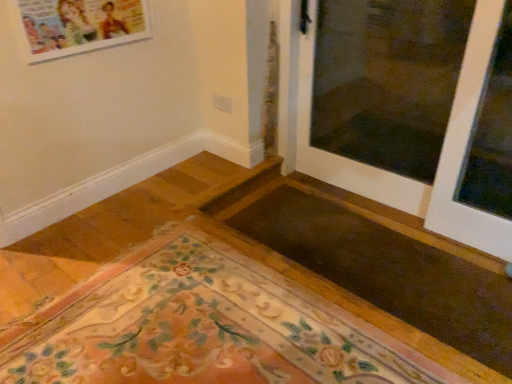
Where is `floral carpet at lower left`? This screenshot has height=384, width=512. floral carpet at lower left is located at coordinates (202, 327).

This screenshot has width=512, height=384. I want to click on floral carpet at lower left, so click(202, 327).

How different are the orientations of white glossy door at upper right and floral carpet at lower left in degrees?

The facing directions of white glossy door at upper right and floral carpet at lower left are 90.8 degrees apart.

From the image's perspective, is white glossy door at upper right below floral carpet at lower left?

No.

From a real-world perspective, is white glossy door at upper right physically above floral carpet at lower left?

Yes.

Based on the photo, is transparent glass window at right positioned behind floral carpet at lower left?

Yes, the depth of transparent glass window at right is greater than that of floral carpet at lower left.

Considering the sizes of objects transparent glass window at right and floral carpet at lower left in the image provided, who is bigger, transparent glass window at right or floral carpet at lower left?

floral carpet at lower left.

Which point is more distant from viewer, (510, 167) or (198, 309)?

The point (510, 167) is more distant.

Is transparent glass window at right located within white glossy door at upper right?

Yes, transparent glass window at right is surrounded by white glossy door at upper right.

Which is behind, white glossy door at upper right or transparent glass window at right?

transparent glass window at right is behind.

Is point (307, 91) positioned in front of point (495, 214)?

No.

Does white glossy door at upper right have a greater height compared to transparent glass window at right?

In fact, white glossy door at upper right may be shorter than transparent glass window at right.

Could you tell me if floral carpet at lower left is facing transparent glass window at right?

No.

Identify the location of mat lying below the transparent glass window at right (from the image's perspective). The width and height of the screenshot is (512, 384). (202, 327).

How different are the orientations of floral carpet at lower left and transparent glass window at right in degrees?

90.8 degrees.

From the picture: Considering the relative positions of transparent glass window at right and white glossy door at upper right in the image provided, is transparent glass window at right to the right of white glossy door at upper right from the viewer's perspective?

Yes, transparent glass window at right is to the right of white glossy door at upper right.

From the image's perspective, between transparent glass window at right and white glossy door at upper right, which one is located above?

white glossy door at upper right is shown above in the image.

Is transparent glass window at right touching white glossy door at upper right?

transparent glass window at right and white glossy door at upper right are not in contact.

Is floral carpet at lower left oriented away from white glossy door at upper right?

That's not correct — floral carpet at lower left is not looking away from white glossy door at upper right.

Can you confirm if floral carpet at lower left is shorter than white glossy door at upper right?

Yes.

From the image's perspective, is floral carpet at lower left below white glossy door at upper right?

Yes.

Find the location of `door on the right of floral carpet at lower left`. door on the right of floral carpet at lower left is located at coordinates (440, 154).

You are a GUI agent. You are given a task and a screenshot of the screen. Output one action in this format:
    pyautogui.click(x=<x>, y=<y>)
    Task: Click on the window that appears above the floral carpet at lower left (from the image's perspective)
    This screenshot has width=512, height=384.
    Given the screenshot: What is the action you would take?
    pyautogui.click(x=492, y=133)

When comparing their distances from floral carpet at lower left, does white glossy door at upper right or transparent glass window at right seem further?

The object further to floral carpet at lower left is transparent glass window at right.

Based on their spatial positions, is transparent glass window at right or white glossy door at upper right closer to floral carpet at lower left?

white glossy door at upper right is closer to floral carpet at lower left.

Looking at this image, based on their spatial positions, is floral carpet at lower left or white glossy door at upper right closer to transparent glass window at right?

white glossy door at upper right.

Estimate the real-world distances between objects in this image. Which object is further from transparent glass window at right, white glossy door at upper right or floral carpet at lower left?

floral carpet at lower left is positioned further to the anchor transparent glass window at right.

Estimate the real-world distances between objects in this image. Which object is further from white glossy door at upper right, floral carpet at lower left or transparent glass window at right?

floral carpet at lower left lies further to white glossy door at upper right than the other object.

Based on their spatial positions, is transparent glass window at right or floral carpet at lower left closer to white glossy door at upper right?

Based on the image, transparent glass window at right appears to be nearer to white glossy door at upper right.

You are a GUI agent. You are given a task and a screenshot of the screen. Output one action in this format:
    pyautogui.click(x=<x>, y=<y>)
    Task: Click on the door between floral carpet at lower left and transparent glass window at right from left to right
    Image resolution: width=512 pixels, height=384 pixels.
    Given the screenshot: What is the action you would take?
    pyautogui.click(x=440, y=154)